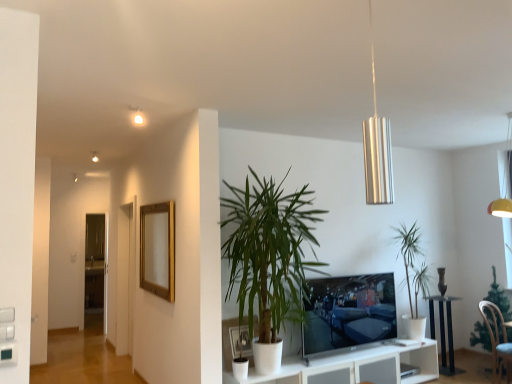
Question: Could you tell me if gold wooden picture frame at upper left, positioned as the first picture frame in top-to-bottom order, is facing green leafy plant at lower right, acting as the first houseplant starting from the right?

Choices:
 (A) no
 (B) yes

Answer: (A)

Question: Can you confirm if gold wooden picture frame at upper left, the second picture frame positioned from the bottom, is thinner than green leafy plant at lower right, acting as the first houseplant starting from the right?

Choices:
 (A) no
 (B) yes

Answer: (B)

Question: Is gold wooden picture frame at upper left, positioned as the first picture frame in top-to-bottom order, to the right of green leafy plant at lower right, acting as the first houseplant starting from the right, from the viewer's perspective?

Choices:
 (A) no
 (B) yes

Answer: (A)

Question: Is the surface of gold wooden picture frame at upper left, the second picture frame positioned from the bottom, in direct contact with green leafy plant at lower right, acting as the first houseplant starting from the right?

Choices:
 (A) yes
 (B) no

Answer: (B)

Question: From the image's perspective, is gold wooden picture frame at upper left, placed as the first picture frame when sorted from left to right, located beneath green leafy plant at lower right, acting as the 3th houseplant starting from the left?

Choices:
 (A) no
 (B) yes

Answer: (A)

Question: From their relative heights in the image, would you say silver metallic pendant light at upper center is taller or shorter than green leafy plant at center, which appears as the first houseplant when viewed from the left?

Choices:
 (A) short
 (B) tall

Answer: (A)

Question: From a real-world perspective, is silver metallic pendant light at upper center positioned above or below green leafy plant at center, positioned as the third houseplant in right-to-left order?

Choices:
 (A) below
 (B) above

Answer: (B)

Question: From the image's perspective, is silver metallic pendant light at upper center positioned above or below green leafy plant at center, positioned as the third houseplant in right-to-left order?

Choices:
 (A) above
 (B) below

Answer: (A)

Question: Is silver metallic pendant light at upper center bigger or smaller than green leafy plant at center, positioned as the third houseplant in right-to-left order?

Choices:
 (A) big
 (B) small

Answer: (B)

Question: Is point (294, 284) positioned closer to the camera than point (162, 249)?

Choices:
 (A) farther
 (B) closer

Answer: (B)

Question: From the image's perspective, is green leafy plant at center, which appears as the first houseplant when viewed from the left, located above or below gold wooden picture frame at upper left, placed as the first picture frame when sorted from left to right?

Choices:
 (A) above
 (B) below

Answer: (B)

Question: Is green leafy plant at center, which appears as the first houseplant when viewed from the left, situated inside gold wooden picture frame at upper left, positioned as the first picture frame in top-to-bottom order, or outside?

Choices:
 (A) inside
 (B) outside

Answer: (B)

Question: Is green leafy plant at center, which appears as the first houseplant when viewed from the left, to the left or to the right of gold wooden picture frame at upper left, marked as the first picture frame in a back-to-front arrangement, in the image?

Choices:
 (A) left
 (B) right

Answer: (B)

Question: From the image's perspective, is light blue fabric chair at lower right above or below green leafy plant at lower right, acting as the first houseplant starting from the right?

Choices:
 (A) below
 (B) above

Answer: (A)

Question: In terms of height, does light blue fabric chair at lower right look taller or shorter compared to green leafy plant at lower right, acting as the 3th houseplant starting from the left?

Choices:
 (A) tall
 (B) short

Answer: (B)